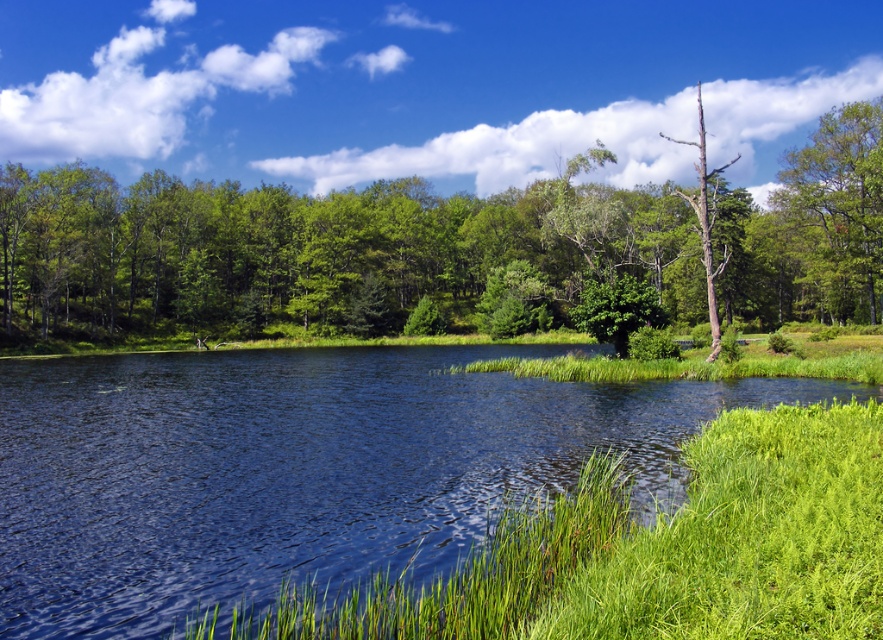
Question: Which point is farther to the camera?

Choices:
 (A) (73, 568)
 (B) (825, 193)
 (C) (834, 262)
 (D) (698, 157)

Answer: (D)

Question: Among these points, which one is nearest to the camera?

Choices:
 (A) (844, 172)
 (B) (580, 220)
 (C) (700, 248)
 (D) (331, 497)

Answer: (D)

Question: Which object is closer to the camera taking this photo?

Choices:
 (A) bare wood tree at right
 (B) blue water at center

Answer: (B)

Question: Does blue water at center appear over green leafy tree at center?

Choices:
 (A) yes
 (B) no

Answer: (B)

Question: Does blue water at center appear over green leafy tree at upper right?

Choices:
 (A) no
 (B) yes

Answer: (A)

Question: Does green leafy tree at center have a lesser width compared to bare wood tree at right?

Choices:
 (A) yes
 (B) no

Answer: (B)